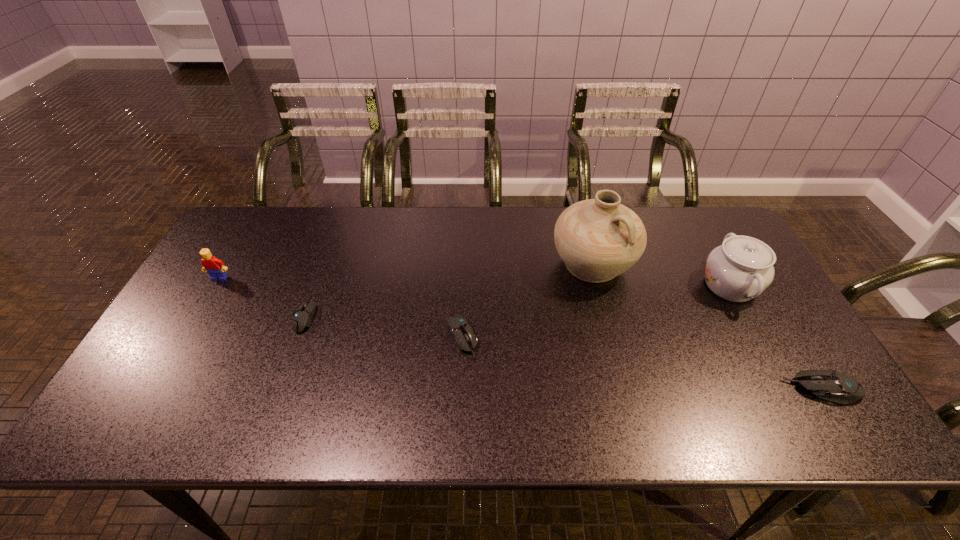
The width and height of the screenshot is (960, 540). Find the location of `the shortest computer mouse`. the shortest computer mouse is located at coordinates [302, 317].

Where is `the second object from left to right`? The image size is (960, 540). the second object from left to right is located at coordinates (302, 317).

Locate an element on the screen. The width and height of the screenshot is (960, 540). the second tallest computer mouse is located at coordinates (459, 328).

The image size is (960, 540). I want to click on the fourth object from right to left, so click(x=459, y=328).

The image size is (960, 540). Identify the location of the rightmost computer mouse. (830, 385).

Identify the location of the nearest object. The image size is (960, 540). (830, 385).

I want to click on chinaware, so click(x=740, y=269).

You are a GUI agent. You are given a task and a screenshot of the screen. Output one action in this format:
    pyautogui.click(x=<x>, y=<y>)
    Task: Click on the fourth shortest object
    The height and width of the screenshot is (540, 960).
    Given the screenshot: What is the action you would take?
    pos(212,265)

Find the location of `the leftmost object`. the leftmost object is located at coordinates (212, 265).

I want to click on pottery, so click(x=598, y=239).